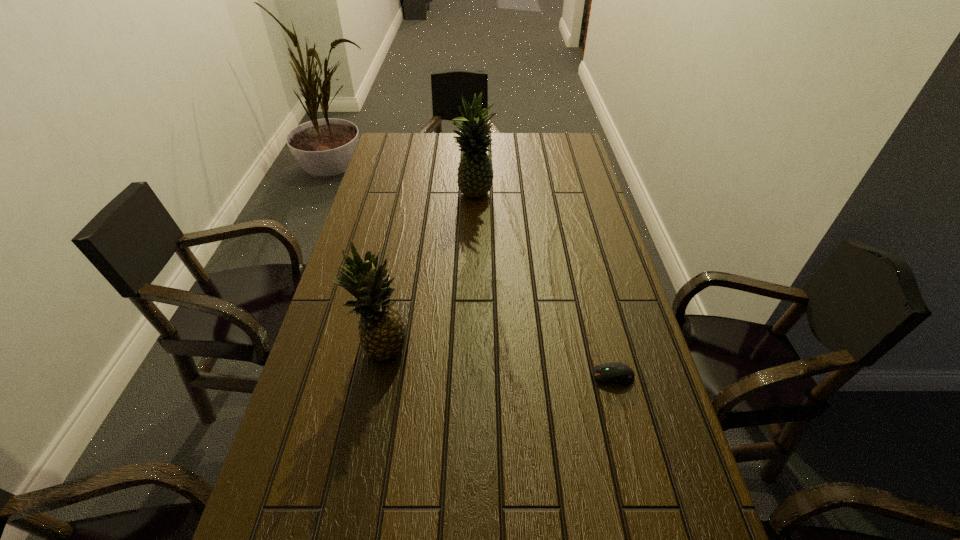
This screenshot has height=540, width=960. In order to click on the second object from right to left in this screenshot , I will do `click(475, 176)`.

Locate an element on the screen. The width and height of the screenshot is (960, 540). the right pineapple is located at coordinates (475, 176).

This screenshot has height=540, width=960. I want to click on the leftmost object, so click(x=382, y=332).

At what (x,y) coordinates should I click in order to perform the action: click on the left pineapple. Please return your answer as a coordinate pair (x, y). This screenshot has height=540, width=960. Looking at the image, I should click on (382, 332).

Find the location of `computer equipment`. computer equipment is located at coordinates (618, 373).

Where is `the shortest object`? This screenshot has height=540, width=960. the shortest object is located at coordinates (618, 373).

Find the location of a particular element. The width and height of the screenshot is (960, 540). vacant space situated 0.360m on the front of the farthest object is located at coordinates (472, 281).

In order to click on free space located on the front of the nearer pineapple in this screenshot , I will do `click(373, 399)`.

This screenshot has width=960, height=540. Identify the location of vacant space situated on the button of the rightmost object. (554, 376).

At what (x,y) coordinates should I click in order to perform the action: click on vacant space located 0.320m on the button of the rightmost object. Please return your answer as a coordinate pair (x, y). Looking at the image, I should click on (455, 376).